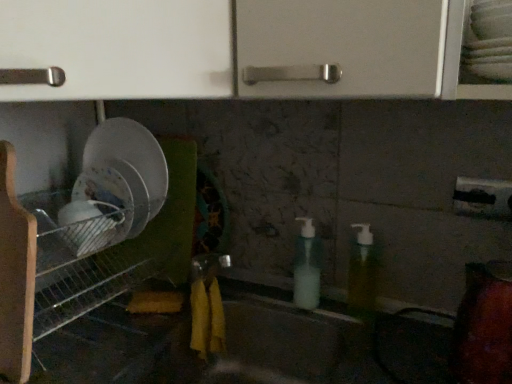
What is the approximate width of translucent plastic soap dispenser at center, which is counted as the 1th soap dispenser, starting from the left?

The width of translucent plastic soap dispenser at center, which is counted as the 1th soap dispenser, starting from the left, is 2.35 inches.

Image resolution: width=512 pixels, height=384 pixels. I want to click on metallic wire rack at left, so click(x=80, y=257).

Considering the sizes of objects metallic wire rack at left and translucent plastic soap dispenser at center, which appears as the second soap dispenser when viewed from the right, in the image provided, who is thinner, metallic wire rack at left or translucent plastic soap dispenser at center, which appears as the second soap dispenser when viewed from the right,?

Thinner between the two is translucent plastic soap dispenser at center, which appears as the second soap dispenser when viewed from the right.

In the image, there is a translucent plastic soap dispenser at center, which appears as the second soap dispenser when viewed from the right. At what (x,y) coordinates should I click in order to perform the action: click on shelf below it (from the image's perspective). Please return your answer as a coordinate pair (x, y). This screenshot has height=384, width=512. Looking at the image, I should click on (80, 257).

Between metallic wire rack at left and translucent plastic soap dispenser at center, which appears as the second soap dispenser when viewed from the right, which one has smaller size?

With smaller size is translucent plastic soap dispenser at center, which appears as the second soap dispenser when viewed from the right.

From a real-world perspective, is metallic wire rack at left physically above translucent plastic soap dispenser at center, which appears as the second soap dispenser when viewed from the right?

Yes, from a real-world perspective, metallic wire rack at left is over translucent plastic soap dispenser at center, which appears as the second soap dispenser when viewed from the right

Looking at this image, between translucent plastic soap dispenser at center, which is counted as the 1th soap dispenser, starting from the left, and translucent plastic soap dispenser at center, the second soap dispenser in the left-to-right sequence, which one has larger size?

Bigger between the two is translucent plastic soap dispenser at center, which is counted as the 1th soap dispenser, starting from the left.

Are translucent plastic soap dispenser at center, which is counted as the 1th soap dispenser, starting from the left, and translucent plastic soap dispenser at center, the second soap dispenser in the left-to-right sequence, beside each other?

No, translucent plastic soap dispenser at center, which is counted as the 1th soap dispenser, starting from the left, is not next to translucent plastic soap dispenser at center, the second soap dispenser in the left-to-right sequence.

From the image's perspective, which one is positioned higher, translucent plastic soap dispenser at center, which appears as the second soap dispenser when viewed from the right, or translucent plastic soap dispenser at center, the second soap dispenser in the left-to-right sequence?

translucent plastic soap dispenser at center, the second soap dispenser in the left-to-right sequence.

In terms of width, does translucent plastic soap dispenser at center, which is counted as the 1th soap dispenser, starting from the left, look wider or thinner when compared to translucent plastic soap dispenser at center, the second soap dispenser in the left-to-right sequence?

Considering their sizes, translucent plastic soap dispenser at center, which is counted as the 1th soap dispenser, starting from the left, looks broader than translucent plastic soap dispenser at center, the second soap dispenser in the left-to-right sequence.

Considering the sizes of objects matte gray sink at center and translucent plastic soap dispenser at center, the second soap dispenser in the left-to-right sequence, in the image provided, who is thinner, matte gray sink at center or translucent plastic soap dispenser at center, the second soap dispenser in the left-to-right sequence,?

Thinner between the two is translucent plastic soap dispenser at center, the second soap dispenser in the left-to-right sequence.

Locate an element on the screen. sink on the left of translucent plastic soap dispenser at center, the second soap dispenser in the left-to-right sequence is located at coordinates (263, 333).

Is matte gray sink at center oriented towards translucent plastic soap dispenser at center, the second soap dispenser in the left-to-right sequence?

No, matte gray sink at center does not turn towards translucent plastic soap dispenser at center, the second soap dispenser in the left-to-right sequence.

Which object is more forward, matte gray sink at center or translucent plastic soap dispenser at center, the second soap dispenser in the left-to-right sequence?

Positioned in front is matte gray sink at center.

From the image's perspective, which one is positioned higher, translucent plastic soap dispenser at center, which is counted as the 1th soap dispenser, starting from the left, or metallic wire rack at left?

translucent plastic soap dispenser at center, which is counted as the 1th soap dispenser, starting from the left, from the image's perspective.

From a real-world perspective, which is physically below, translucent plastic soap dispenser at center, which is counted as the 1th soap dispenser, starting from the left, or metallic wire rack at left?

Result: translucent plastic soap dispenser at center, which is counted as the 1th soap dispenser, starting from the left.

In the scene shown: Considering the relative sizes of translucent plastic soap dispenser at center, which is counted as the 1th soap dispenser, starting from the left, and metallic wire rack at left in the image provided, is translucent plastic soap dispenser at center, which is counted as the 1th soap dispenser, starting from the left, wider than metallic wire rack at left?

In fact, translucent plastic soap dispenser at center, which is counted as the 1th soap dispenser, starting from the left, might be narrower than metallic wire rack at left.

Is matte gray sink at center aimed at translucent plastic soap dispenser at center, which appears as the second soap dispenser when viewed from the right?

No.

From a real-world perspective, is matte gray sink at center on translucent plastic soap dispenser at center, which appears as the second soap dispenser when viewed from the right?

No, from a real-world perspective, matte gray sink at center is not over translucent plastic soap dispenser at center, which appears as the second soap dispenser when viewed from the right

Can you confirm if matte gray sink at center is taller than translucent plastic soap dispenser at center, which appears as the second soap dispenser when viewed from the right?

Indeed, matte gray sink at center has a greater height compared to translucent plastic soap dispenser at center, which appears as the second soap dispenser when viewed from the right.

Between metallic wire rack at left and translucent plastic soap dispenser at center, positioned as the first soap dispenser in right-to-left order, which one has smaller width?

translucent plastic soap dispenser at center, positioned as the first soap dispenser in right-to-left order, is thinner.

Which of these two, metallic wire rack at left or translucent plastic soap dispenser at center, positioned as the first soap dispenser in right-to-left order, is bigger?

With larger size is metallic wire rack at left.

Consider the image. How many degrees apart are the facing directions of metallic wire rack at left and translucent plastic soap dispenser at center, the second soap dispenser in the left-to-right sequence?

There is a 0.00119-degree angle between the facing directions of metallic wire rack at left and translucent plastic soap dispenser at center, the second soap dispenser in the left-to-right sequence.

Is metallic wire rack at left inside or outside of translucent plastic soap dispenser at center, positioned as the first soap dispenser in right-to-left order?

metallic wire rack at left lies outside translucent plastic soap dispenser at center, positioned as the first soap dispenser in right-to-left order.

Could you tell me if translucent plastic soap dispenser at center, which is counted as the 1th soap dispenser, starting from the left, is facing matte gray sink at center?

No.

Identify the location of the 1st soap dispenser located above the matte gray sink at center (from a real-world perspective). click(x=307, y=267).

From a real-world perspective, is translucent plastic soap dispenser at center, which appears as the second soap dispenser when viewed from the right, under matte gray sink at center?

No.

Which of these two, translucent plastic soap dispenser at center, which is counted as the 1th soap dispenser, starting from the left, or matte gray sink at center, stands shorter?

translucent plastic soap dispenser at center, which is counted as the 1th soap dispenser, starting from the left.

Which soap dispenser is the 2nd one when counting from the back of the metallic wire rack at left? Please provide its 2D coordinates.

[(307, 267)]

You are a GUI agent. You are given a task and a screenshot of the screen. Output one action in this format:
    pyautogui.click(x=<x>, y=<y>)
    Task: Click on the soap dispenser to the right of translucent plastic soap dispenser at center, which is counted as the 1th soap dispenser, starting from the left
    
    Given the screenshot: What is the action you would take?
    pyautogui.click(x=362, y=273)

When comparing their distances from metallic wire rack at left, does matte gray sink at center or translucent plastic soap dispenser at center, positioned as the first soap dispenser in right-to-left order, seem further?

translucent plastic soap dispenser at center, positioned as the first soap dispenser in right-to-left order, lies further to metallic wire rack at left than the other object.

Which object lies nearer to the anchor point matte gray sink at center, translucent plastic soap dispenser at center, which appears as the second soap dispenser when viewed from the right, or translucent plastic soap dispenser at center, the second soap dispenser in the left-to-right sequence?

translucent plastic soap dispenser at center, which appears as the second soap dispenser when viewed from the right.

From the image, which object appears to be nearer to translucent plastic soap dispenser at center, positioned as the first soap dispenser in right-to-left order, metallic wire rack at left or translucent plastic soap dispenser at center, which is counted as the 1th soap dispenser, starting from the left?

translucent plastic soap dispenser at center, which is counted as the 1th soap dispenser, starting from the left, lies closer to translucent plastic soap dispenser at center, positioned as the first soap dispenser in right-to-left order, than the other object.

Which object lies nearer to the anchor point translucent plastic soap dispenser at center, the second soap dispenser in the left-to-right sequence, translucent plastic soap dispenser at center, which appears as the second soap dispenser when viewed from the right, or matte gray sink at center?

translucent plastic soap dispenser at center, which appears as the second soap dispenser when viewed from the right, lies closer to translucent plastic soap dispenser at center, the second soap dispenser in the left-to-right sequence, than the other object.

Considering their positions, is translucent plastic soap dispenser at center, which is counted as the 1th soap dispenser, starting from the left, positioned closer to metallic wire rack at left than translucent plastic soap dispenser at center, positioned as the first soap dispenser in right-to-left order?

The object closer to metallic wire rack at left is translucent plastic soap dispenser at center, which is counted as the 1th soap dispenser, starting from the left.

Based on their spatial positions, is translucent plastic soap dispenser at center, which is counted as the 1th soap dispenser, starting from the left, or metallic wire rack at left further from matte gray sink at center?

metallic wire rack at left is further to matte gray sink at center.

From the image, which object appears to be nearer to metallic wire rack at left, matte gray sink at center or translucent plastic soap dispenser at center, which is counted as the 1th soap dispenser, starting from the left?

matte gray sink at center.

Looking at the image, which one is located closer to metallic wire rack at left, translucent plastic soap dispenser at center, positioned as the first soap dispenser in right-to-left order, or matte gray sink at center?

matte gray sink at center is positioned closer to the anchor metallic wire rack at left.

You are a GUI agent. You are given a task and a screenshot of the screen. Output one action in this format:
    pyautogui.click(x=<x>, y=<y>)
    Task: Click on the soap dispenser between matte gray sink at center and translucent plastic soap dispenser at center, which is counted as the 1th soap dispenser, starting from the left, along the z-axis
    This screenshot has height=384, width=512.
    Given the screenshot: What is the action you would take?
    pyautogui.click(x=362, y=273)

Find the location of `sink located between metallic wire rack at left and translucent plastic soap dispenser at center, which is counted as the 1th soap dispenser, starting from the left, in the left-right direction`. sink located between metallic wire rack at left and translucent plastic soap dispenser at center, which is counted as the 1th soap dispenser, starting from the left, in the left-right direction is located at coordinates (263, 333).

Locate an element on the screen. Image resolution: width=512 pixels, height=384 pixels. soap dispenser situated between metallic wire rack at left and translucent plastic soap dispenser at center, the second soap dispenser in the left-to-right sequence, from left to right is located at coordinates (307, 267).

This screenshot has width=512, height=384. Find the location of `sink situated between metallic wire rack at left and translucent plastic soap dispenser at center, positioned as the first soap dispenser in right-to-left order, from left to right`. sink situated between metallic wire rack at left and translucent plastic soap dispenser at center, positioned as the first soap dispenser in right-to-left order, from left to right is located at coordinates (263, 333).